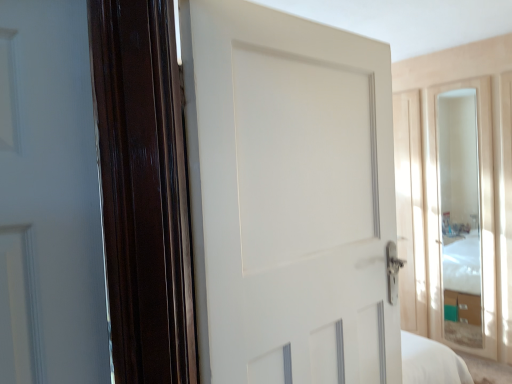
Identify the location of white matte door at center. The image size is (512, 384). (290, 198).

The height and width of the screenshot is (384, 512). What do you see at coordinates (290, 198) in the screenshot? I see `white matte door at center` at bounding box center [290, 198].

Measure the distance between point (465, 347) and camera.

The depth of point (465, 347) is 11.89 feet.

What do you see at coordinates (461, 220) in the screenshot? I see `clear glass mirror at right` at bounding box center [461, 220].

Measure the distance between clear glass mirror at right and camera.

The distance of clear glass mirror at right from camera is 3.14 meters.

Where is `clear glass mirror at right`? The image size is (512, 384). clear glass mirror at right is located at coordinates (461, 220).

Where is `white matte door at center`? Image resolution: width=512 pixels, height=384 pixels. white matte door at center is located at coordinates (290, 198).

Can you confirm if white matte door at center is positioned to the left of clear glass mirror at right?

Yes.

Considering their positions, is white matte door at center located in front of or behind clear glass mirror at right?

white matte door at center is positioned closer to the viewer than clear glass mirror at right.

Is point (216, 210) closer or farther from the camera than point (450, 201)?

Point (216, 210).

From the image's perspective, is white matte door at center positioned above or below clear glass mirror at right?

Clearly, from the image's perspective, white matte door at center is above clear glass mirror at right.

From a real-world perspective, which object rests below the other?

clear glass mirror at right, from a real-world perspective.

Considering the sizes of objects white matte door at center and clear glass mirror at right in the image provided, who is thinner, white matte door at center or clear glass mirror at right?

clear glass mirror at right.

Is white matte door at center taller or shorter than clear glass mirror at right?

In the image, white matte door at center appears to be shorter than clear glass mirror at right.

Considering the relative sizes of white matte door at center and clear glass mirror at right in the image provided, is white matte door at center bigger than clear glass mirror at right?

Yes.

Is clear glass mirror at right completely or partially inside white matte door at center?

No, white matte door at center does not contain clear glass mirror at right.

Based on the photo, is there a large distance between white matte door at center and clear glass mirror at right?

white matte door at center is positioned a significant distance from clear glass mirror at right.

Is white matte door at center turned away from clear glass mirror at right?

white matte door at center does not have its back to clear glass mirror at right.

How different are the orientations of white matte door at center and clear glass mirror at right in degrees?

89.3 degrees.

Identify the location of glass door behind the white matte door at center. (461, 220).

Which is more to the left, clear glass mirror at right or white matte door at center?

white matte door at center is more to the left.

Between clear glass mirror at right and white matte door at center, which one is positioned in front?

white matte door at center.

Which is nearer, (483, 255) or (368, 256)?

Point (368, 256)

From the image's perspective, which one is positioned higher, clear glass mirror at right or white matte door at center?

white matte door at center appears higher in the image.

From a real-world perspective, who is located higher, clear glass mirror at right or white matte door at center?

In real-world perspective, white matte door at center is above.

Which of these two, clear glass mirror at right or white matte door at center, is thinner?

clear glass mirror at right.

Between clear glass mirror at right and white matte door at center, which one has less height?

white matte door at center.

Does clear glass mirror at right have a smaller size compared to white matte door at center?

Yes.

Is clear glass mirror at right inside or outside of white matte door at center?

clear glass mirror at right is not inside white matte door at center, it's outside.

Consider the image. Are clear glass mirror at right and white matte door at center far apart?

Yes, clear glass mirror at right and white matte door at center are located far from each other.

Is clear glass mirror at right positioned with its back to white matte door at center?

No, white matte door at center is not at the back of clear glass mirror at right.

How far apart are clear glass mirror at right and white matte door at center?

They are 8.44 feet apart.

The width and height of the screenshot is (512, 384). I want to click on glass door behind the white matte door at center, so click(461, 220).

What are the coordinates of `glass door to the right of white matte door at center` in the screenshot? It's located at (461, 220).

Identify the location of door above the clear glass mirror at right (from a real-world perspective). This screenshot has height=384, width=512. (290, 198).